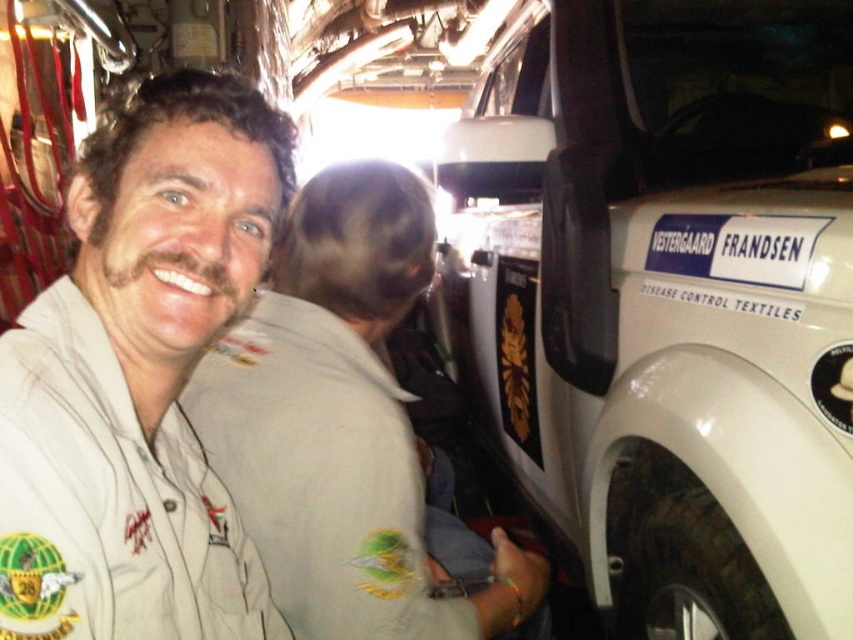
You are sitting at the back of the vehicle and want to reach a point closer to you. Which of the two points, point (822, 228) or point (73, 618), is closer to you?

Point (822, 228) is further to the viewer than point (73, 618), so the point closer to you is point (73, 618).

You are a delivery person who needs to place a 12 inch long package between the white matte vehicle at right and the white matte shirt at upper left. Can the package fit in the space between them?

The distance between the white matte vehicle at right and the white matte shirt at upper left is 39.06 inches. Since the package is 12 inches long, it can fit in the space between them as there is enough room.

You are a passenger in the vehicle and want to place a 1.2 meter tall box between the white matte vehicle at right and the light brown uniform at left. Can the box fit vertically between them?

The white matte vehicle at right is much taller than the light brown uniform at left. The height difference means the space between them might not accommodate a 1.2 meter tall box vertically. However, without exact measurements of the vertical clearance, it is uncertain. The answer is inconclusive based on the provided information.